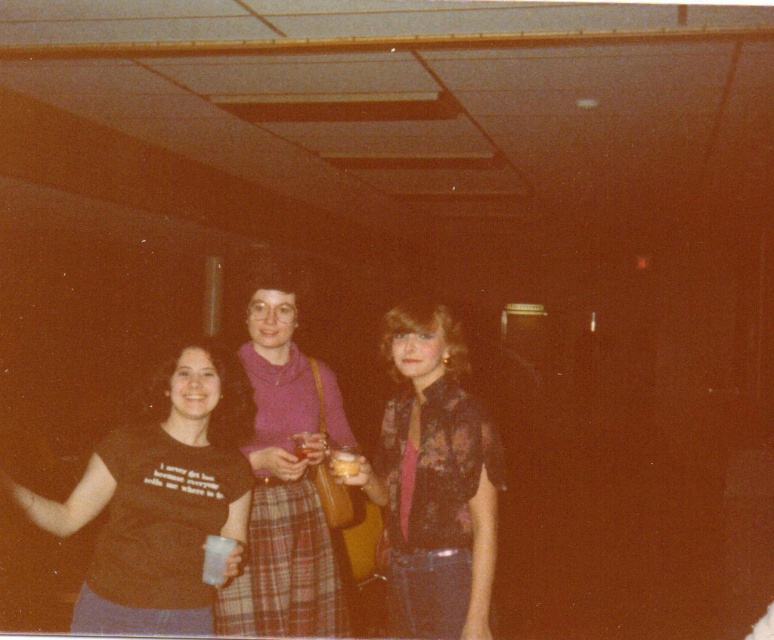
Does point (132, 436) come farther from viewer compared to point (495, 458)?

That is False.

Find the location of a particular element. This screenshot has height=640, width=774. black t-shirt at left is located at coordinates (156, 509).

Between point (91, 461) and point (302, 472), which one is positioned behind?

The point (302, 472) is more distant.

Does black t-shirt at left have a lesser width compared to purple plaid skirt at center?

In fact, black t-shirt at left might be wider than purple plaid skirt at center.

Is point (135, 548) farther from camera compared to point (257, 344)?

That is False.

At what (x,y) coordinates should I click in order to perform the action: click on black t-shirt at left. Please return your answer as a coordinate pair (x, y). This screenshot has height=640, width=774. Looking at the image, I should click on (156, 509).

Looking at this image, is floral-patterned blouse at center smaller than translucent plastic cup at center?

No, floral-patterned blouse at center is not smaller than translucent plastic cup at center.

Where is `floral-patterned blouse at center`? The image size is (774, 640). floral-patterned blouse at center is located at coordinates (433, 483).

This screenshot has width=774, height=640. Identify the location of floral-patterned blouse at center. (433, 483).